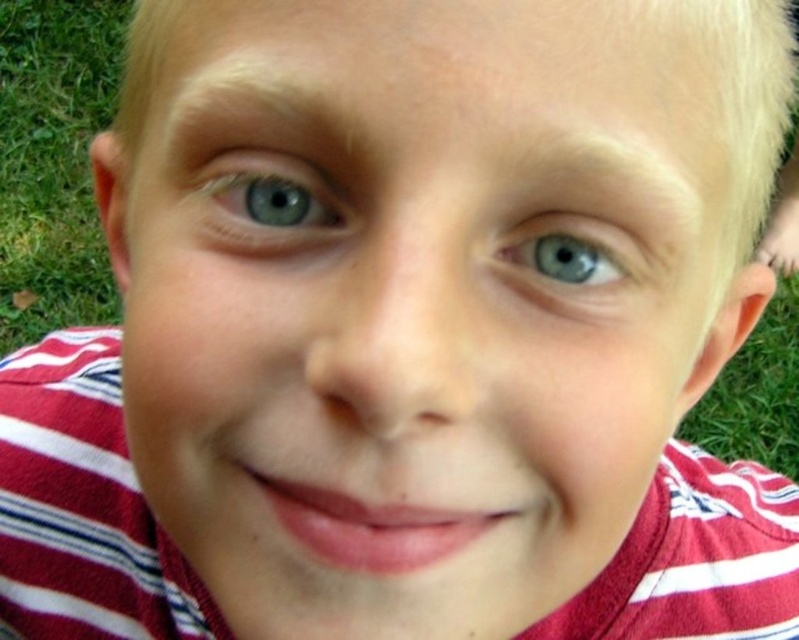
Which is in front, point (221, 166) or point (610, 250)?

Positioned in front is point (610, 250).

Is blue glossy eye at upper left positioned behind blue glossy eye at upper center?

Yes.

The height and width of the screenshot is (640, 799). What are the coordinates of `blue glossy eye at upper left` in the screenshot? It's located at (269, 202).

Find the location of `blue glossy eye at upper left`. blue glossy eye at upper left is located at coordinates (269, 202).

Describe the element at coordinates (54, 163) in the screenshot. I see `green grass at lower left` at that location.

Between green grass at lower left and blue glossy eye at upper center, which one is positioned higher?

green grass at lower left is higher up.

Is point (10, 168) behind point (571, 220)?

Yes, point (10, 168) is behind point (571, 220).

I want to click on green grass at lower left, so click(54, 163).

Can you confirm if green grass at lower left is bigger than blue glossy eye at upper left?

Yes, green grass at lower left is bigger than blue glossy eye at upper left.

Which is more to the right, green grass at lower left or blue glossy eye at upper left?

blue glossy eye at upper left

Identify the location of green grass at lower left. (54, 163).